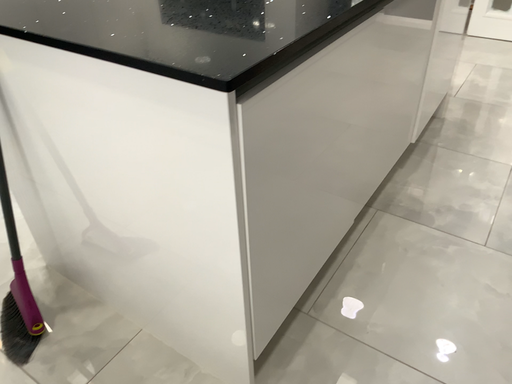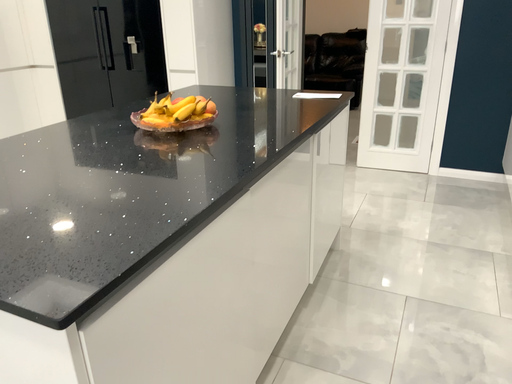
Question: Which way did the camera rotate in the video?

Choices:
 (A) rotated right
 (B) rotated left

Answer: (A)